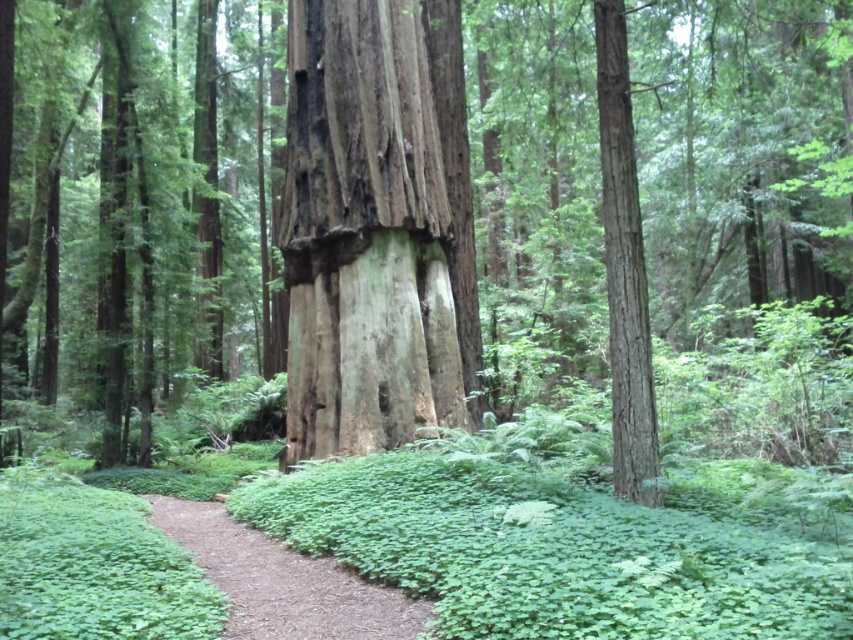
Between brown dirt path at center and smooth brown tree trunk at center-right, which one has less height?

Standing shorter between the two is brown dirt path at center.

Where is `brown dirt path at center`? Image resolution: width=853 pixels, height=640 pixels. brown dirt path at center is located at coordinates (283, 580).

At what (x,y) coordinates should I click in order to perform the action: click on brown dirt path at center. Please return your answer as a coordinate pair (x, y). The height and width of the screenshot is (640, 853). Looking at the image, I should click on (283, 580).

Describe the element at coordinates (364, 234) in the screenshot. I see `gray textured tree trunk at center` at that location.

Between gray textured tree trunk at center and smooth brown tree trunk at center-right, which one has less height?

gray textured tree trunk at center

I want to click on gray textured tree trunk at center, so click(364, 234).

Is gray textured tree trunk at center smaller than brown dirt path at center?

No.

Is gray textured tree trunk at center bigger than brown dirt path at center?

Yes.

Does point (395, 346) come behind point (192, 532)?

Yes, point (395, 346) is behind point (192, 532).

You are a GUI agent. You are given a task and a screenshot of the screen. Output one action in this format:
    pyautogui.click(x=<x>, y=<y>)
    Task: Click on the gray textured tree trunk at center
    This screenshot has height=640, width=853.
    Given the screenshot: What is the action you would take?
    pyautogui.click(x=364, y=234)